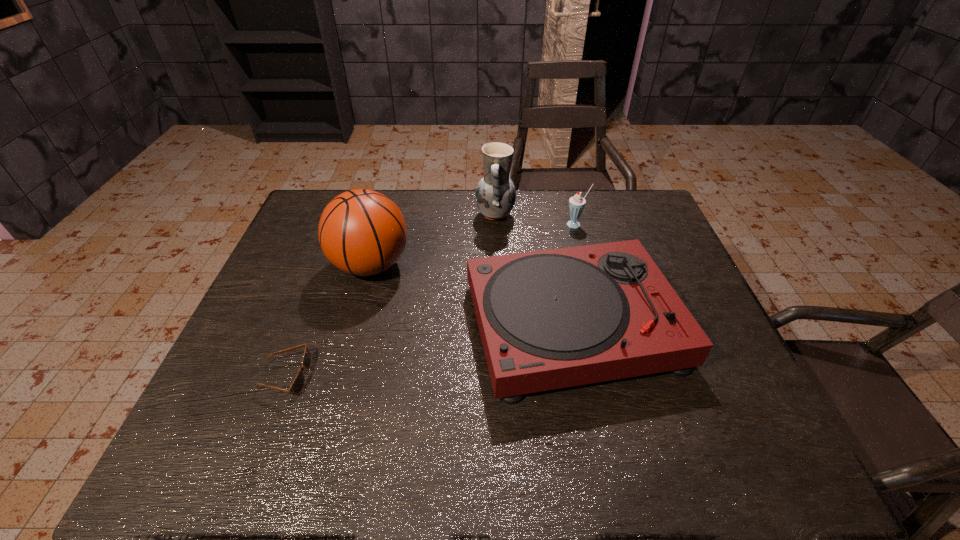
Locate an element on the screen. vacant space located 0.240m on the back of the record player is located at coordinates coord(551,217).

Identify the location of free point located 0.340m on the frames of the sunglasses. The height and width of the screenshot is (540, 960). (460, 376).

At what (x,y) coordinates should I click in order to perform the action: click on pottery situated at the far edge. Please return your answer as a coordinate pair (x, y). This screenshot has height=540, width=960. Looking at the image, I should click on (495, 194).

The image size is (960, 540). I want to click on milkshake that is at the far edge, so click(x=577, y=203).

Find the location of a particular element. basketball situated at the left edge is located at coordinates (362, 232).

This screenshot has height=540, width=960. I want to click on sunglasses at the left edge, so click(x=297, y=386).

This screenshot has height=540, width=960. I want to click on object that is at the right edge, so click(550, 319).

I want to click on vacant region at the far edge, so click(x=418, y=218).

In the image, there is a desktop. Where is `vacant space at the near edge`? The image size is (960, 540). vacant space at the near edge is located at coordinates (296, 459).

This screenshot has width=960, height=540. Find the location of `free space at the left edge of the desktop`. free space at the left edge of the desktop is located at coordinates (315, 314).